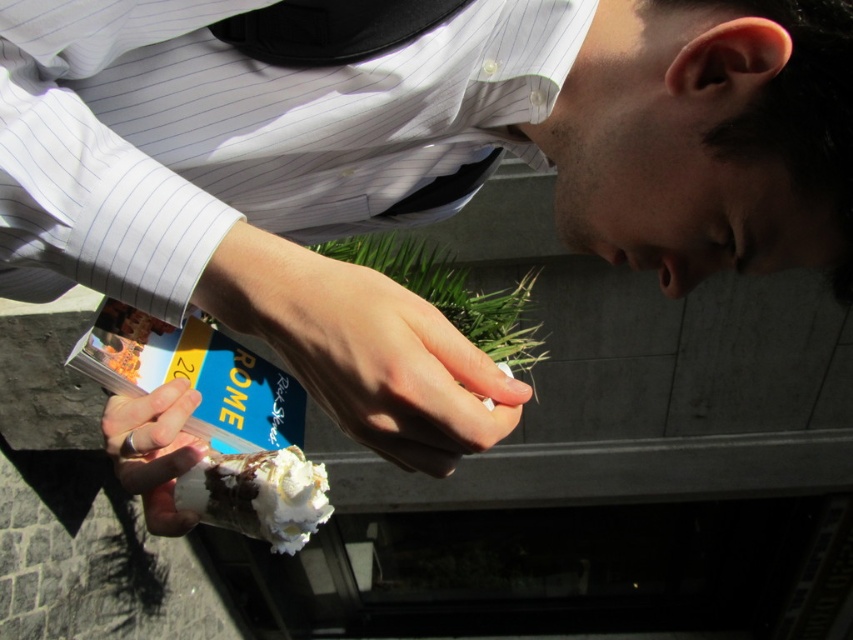
Question: Among these objects, which one is farthest from the camera?

Choices:
 (A) smooth skin hand at center
 (B) white striped dress shirt at center
 (C) white matte ice cream cone at center
 (D) whipped cream cone at center

Answer: (D)

Question: Which point appears closest to the camera in this image?

Choices:
 (A) (480, 310)
 (B) (425, 339)

Answer: (B)

Question: Can you confirm if green leafy grass at center is bigger than whipped cream cone at center?

Choices:
 (A) yes
 (B) no

Answer: (A)

Question: Which of the following is the farthest from the observer?

Choices:
 (A) smooth skin hand at center
 (B) white matte ice cream cone at center

Answer: (B)

Question: Observing the image, what is the correct spatial positioning of smooth skin hand at center in reference to white matte ice cream cone at center?

Choices:
 (A) below
 (B) above

Answer: (B)

Question: Does white striped dress shirt at center appear under green leafy grass at center?

Choices:
 (A) yes
 (B) no

Answer: (B)